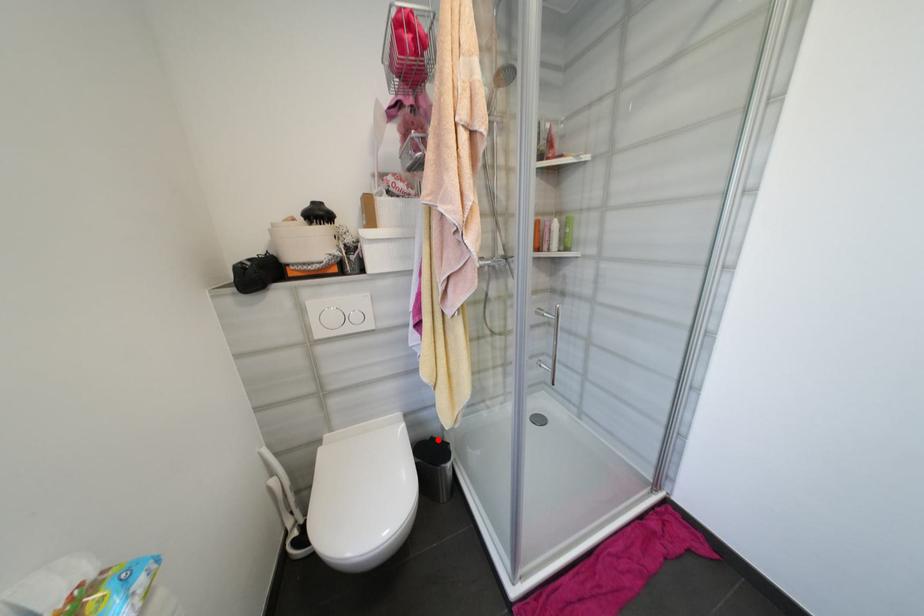
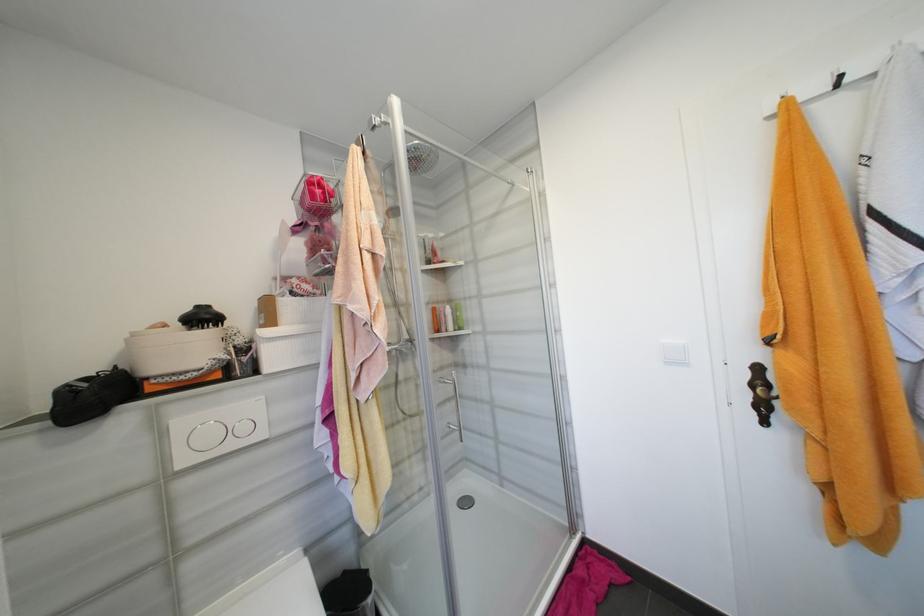
In the second image, find the point that corresponds to the highlighted location in the first image.

(350, 573)